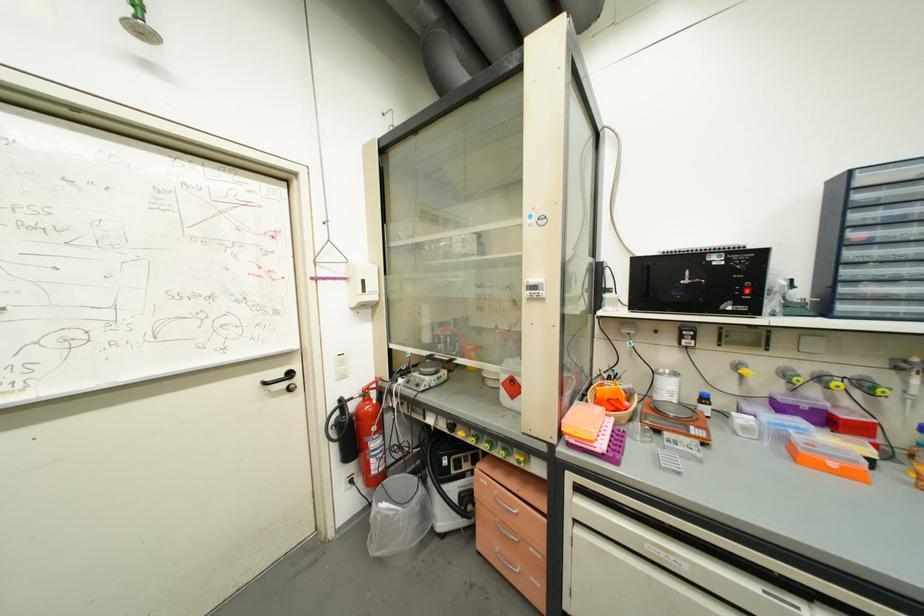
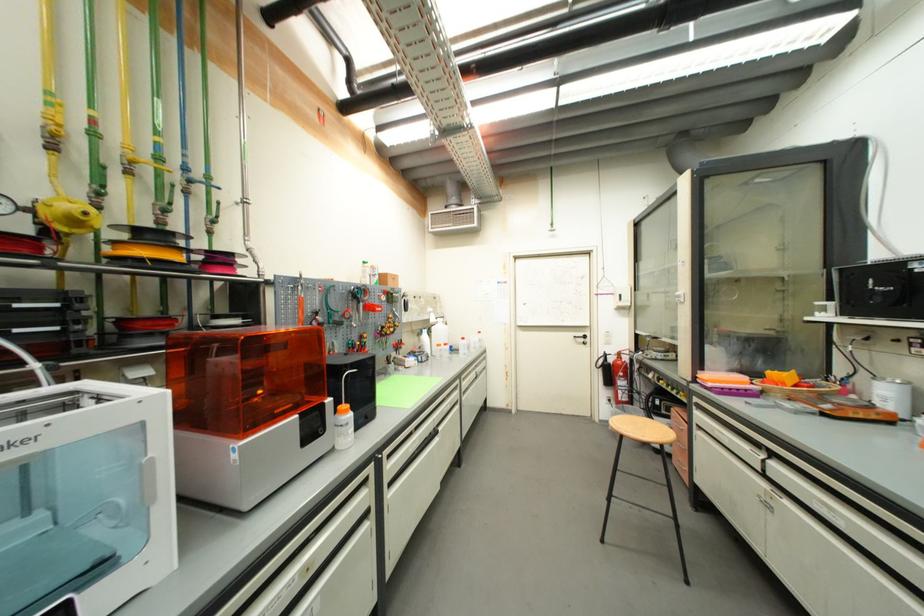
Find the pixel in the second image that matches point (380, 430) in the first image.

(626, 376)